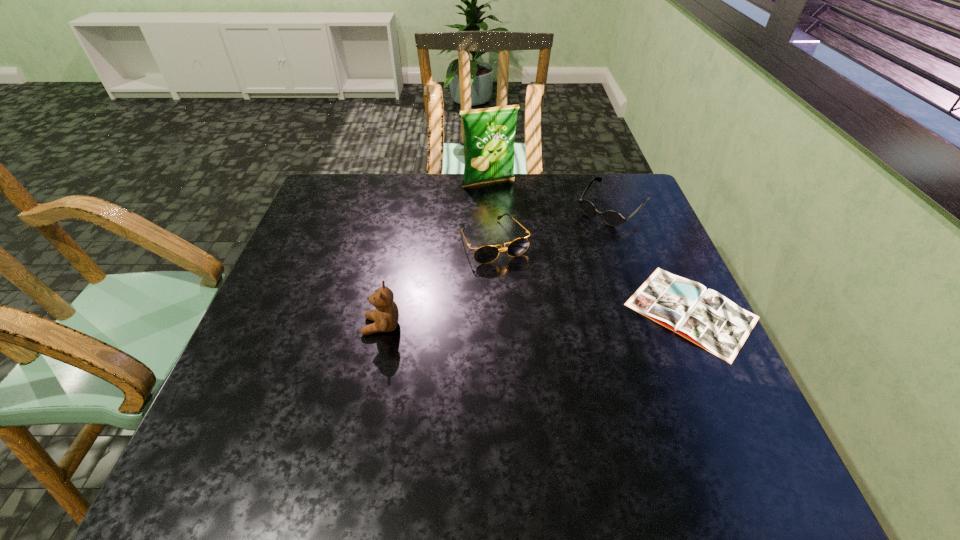
At what (x,y) coordinates should I click in order to perform the action: click on crisp (potato chip) positioned at the far edge. Please return your answer as a coordinate pair (x, y). The height and width of the screenshot is (540, 960). Looking at the image, I should click on (489, 133).

At what (x,y) coordinates should I click in order to perform the action: click on book positioned at the right edge. Please return your answer as a coordinate pair (x, y). Image resolution: width=960 pixels, height=540 pixels. Looking at the image, I should click on (705, 317).

The height and width of the screenshot is (540, 960). In order to click on sunglasses located at the right edge in this screenshot , I will do `click(612, 218)`.

Locate an element on the screen. object positioned at the far right corner is located at coordinates (612, 218).

Where is `free space at the far edge`? free space at the far edge is located at coordinates tap(441, 178).

The image size is (960, 540). Identify the location of vacant space at the near edge of the desktop. (499, 399).

Find the location of a particular element. This screenshot has height=540, width=960. free space at the left edge of the desktop is located at coordinates (289, 321).

At what (x,y) coordinates should I click in order to perform the action: click on free location at the right edge of the desktop. Please return your answer as a coordinate pair (x, y). Looking at the image, I should click on (661, 339).

In the image, there is a desktop. Identify the location of vacant area at the far left corner. (356, 175).

Where is `vacant region at the far right corner`? Image resolution: width=960 pixels, height=540 pixels. vacant region at the far right corner is located at coordinates (644, 208).